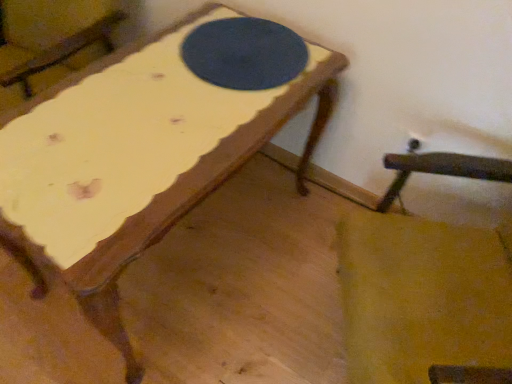
Question: Which direction should I rotate to look at dark blue felt table tennis table at center?

Choices:
 (A) left
 (B) right

Answer: (A)

Question: Can you confirm if dark blue felt table tennis table at center is positioned to the right of wooden rocking chair at lower right?

Choices:
 (A) no
 (B) yes

Answer: (A)

Question: Can you confirm if dark blue felt table tennis table at center is taller than wooden rocking chair at lower right?

Choices:
 (A) yes
 (B) no

Answer: (B)

Question: Are dark blue felt table tennis table at center and wooden rocking chair at lower right located far from each other?

Choices:
 (A) no
 (B) yes

Answer: (A)

Question: Does dark blue felt table tennis table at center have a smaller size compared to wooden rocking chair at lower right?

Choices:
 (A) no
 (B) yes

Answer: (B)

Question: From a real-world perspective, is dark blue felt table tennis table at center located higher than wooden rocking chair at lower right?

Choices:
 (A) yes
 (B) no

Answer: (A)

Question: Is dark blue felt table tennis table at center behind wooden rocking chair at lower right?

Choices:
 (A) no
 (B) yes

Answer: (B)

Question: Is wooden rocking chair at lower right aimed at dark blue felt table tennis table at center?

Choices:
 (A) yes
 (B) no

Answer: (B)

Question: Is the position of wooden rocking chair at lower right more distant than that of dark blue felt table tennis table at center?

Choices:
 (A) no
 (B) yes

Answer: (A)

Question: Considering the relative sizes of wooden rocking chair at lower right and dark blue felt table tennis table at center in the image provided, is wooden rocking chair at lower right wider than dark blue felt table tennis table at center?

Choices:
 (A) yes
 (B) no

Answer: (A)

Question: Is wooden rocking chair at lower right in contact with dark blue felt table tennis table at center?

Choices:
 (A) no
 (B) yes

Answer: (A)

Question: From the image's perspective, would you say wooden rocking chair at lower right is positioned over dark blue felt table tennis table at center?

Choices:
 (A) no
 (B) yes

Answer: (A)

Question: From a real-world perspective, is wooden rocking chair at lower right located higher than dark blue felt table tennis table at center?

Choices:
 (A) no
 (B) yes

Answer: (A)

Question: From a real-world perspective, is wooden rocking chair at lower right physically located above or below dark blue felt table tennis table at center?

Choices:
 (A) above
 (B) below

Answer: (B)